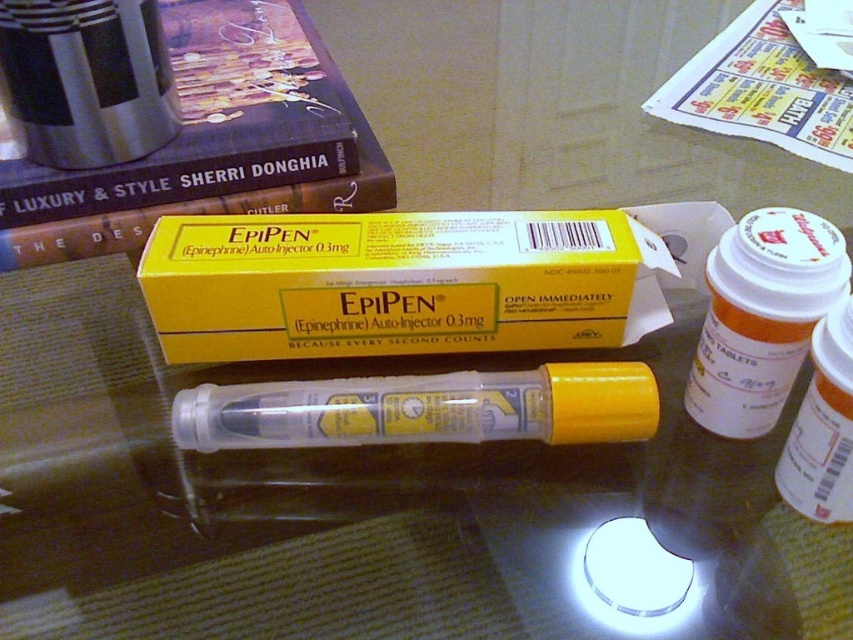
You are organizing items on a shelf and need to stack the yellow cardboard box at center and the hardcover book at upper left. Which item should you place at the bottom to ensure stability?

The hardcover book at upper left should be placed at the bottom because it has a greater height than the yellow cardboard box at center, providing a stable base.

You are organizing a first aid kit and need to place the yellow cardboard box at center and the hardcover book at upper left into a drawer. The drawer has limited space. Which item should you place first to ensure both fit?

The yellow cardboard box at center is smaller in size compared to the hardcover book at upper left, so you should place the hardcover book at upper left first to make space for the smaller item.